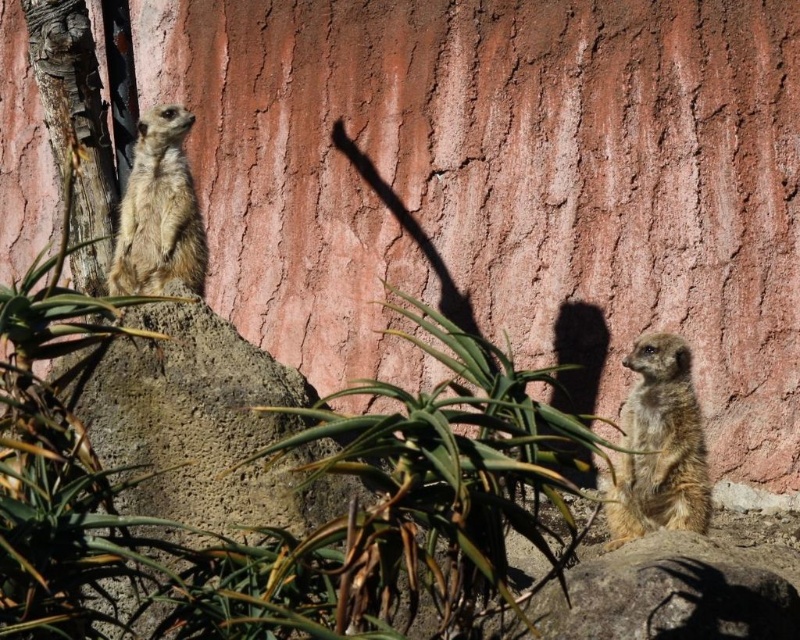
You are a photographer trying to capture a photo of the fuzzy brown meerkat at lower right and the green leafy plant at center. Since you want the meerkat to be the main focus, where should you position the meerkat relative to the plant?

A: The green leafy plant at center is positioned on the left side of the fuzzy brown meerkat at lower right, so to make the meerkat the main focus, you should position the meerkat to the right of the plant.

You are a gardener who wants to plant a new green leafy plant at center. The current spot at point (x=436, y=490) is occupied by a green leafy plant at center. Is there enough space to plant another one there?

The point (x=436, y=490) is already occupied by the green leafy plant at center, so there is no space to plant another one there.

You are a photographer trying to capture a photo of the golden fur meerkat at upper left and the green leafy plant at center. The camera you are using has a maximum focus range of 5 feet. Will you be able to focus on both subjects clearly in the same shot?

The green leafy plant at center is 6.76 feet away from the golden fur meerkat at upper left. Since the distance between them exceeds the camera maximum focus range of 5 feet, you will not be able to focus on both subjects clearly in the same shot.